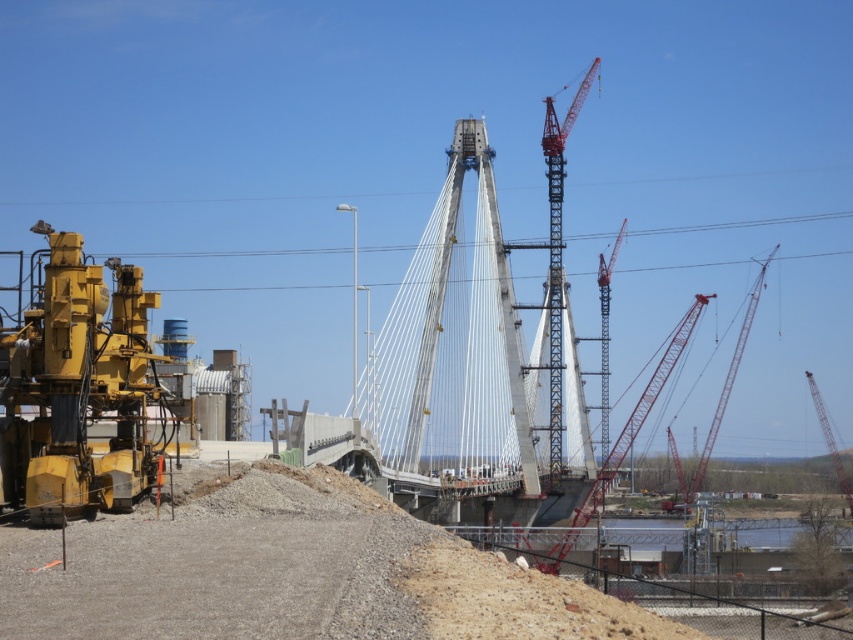
Question: Is red painted metal crane at center bigger than red metal crane at center?

Choices:
 (A) no
 (B) yes

Answer: (B)

Question: Which point is farther to the camera?

Choices:
 (A) (733, 358)
 (B) (631, 433)
 (C) (555, 371)

Answer: (A)

Question: Is brown gravel at lower left closer to the viewer compared to red metallic crane at center?

Choices:
 (A) yes
 (B) no

Answer: (A)

Question: Is brown gravel at lower left to the left of yellow metallic construction equipment at left from the viewer's perspective?

Choices:
 (A) yes
 (B) no

Answer: (B)

Question: Which of the following is the closest to the observer?

Choices:
 (A) (831, 449)
 (B) (607, 404)

Answer: (A)

Question: Based on their relative distances, which object is nearer to the red painted metal crane at center?

Choices:
 (A) red metal crane at right
 (B) brown gravel at lower left
 (C) yellow metallic construction equipment at left
 (D) red metallic crane at right

Answer: (D)